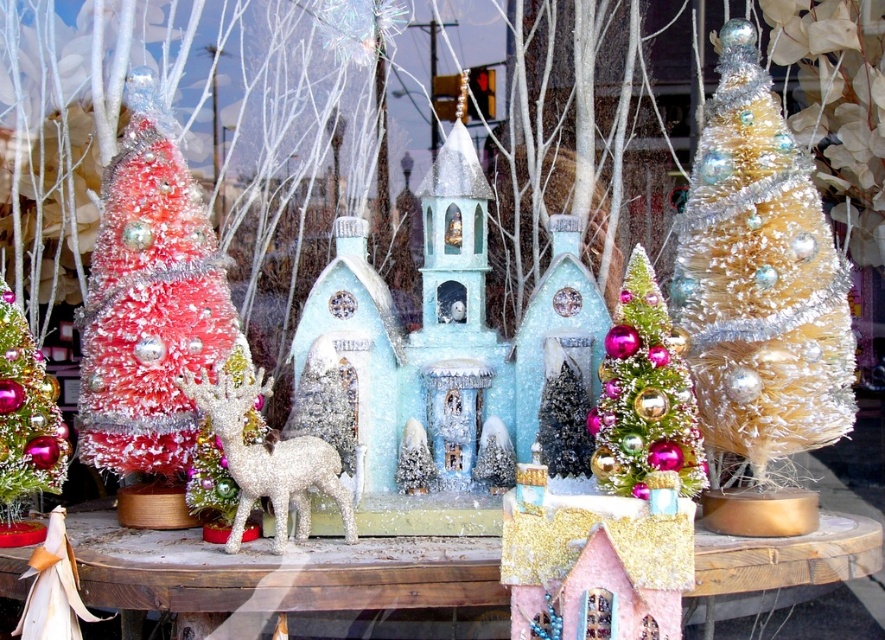
Question: Among these objects, which one is farthest from the camera?

Choices:
 (A) shiny red tinsel christmas tree at left
 (B) shiny silver christmas tree at center
 (C) glittery silver deer at center

Answer: (B)

Question: Which is farther from the gold tinsel christmas tree at right?

Choices:
 (A) shiny silver christmas tree at center
 (B) glittery silver deer at center
 (C) shiny red tinsel christmas tree at left

Answer: (C)

Question: Does gold tinsel christmas tree at right have a lesser width compared to shiny pink tinsel christmas tree at center?

Choices:
 (A) no
 (B) yes

Answer: (A)

Question: In this image, where is shiny pink tinsel christmas tree at center located relative to glittery silver deer at center?

Choices:
 (A) below
 (B) above

Answer: (B)

Question: Does shiny red tinsel christmas tree at left appear over glittery silver deer at center?

Choices:
 (A) yes
 (B) no

Answer: (A)

Question: Which is farther from the glittery silver deer at center?

Choices:
 (A) shiny red tinsel christmas tree at left
 (B) shiny silver christmas tree at center
 (C) gold tinsel christmas tree at right
 (D) shiny pink tinsel christmas tree at center

Answer: (C)